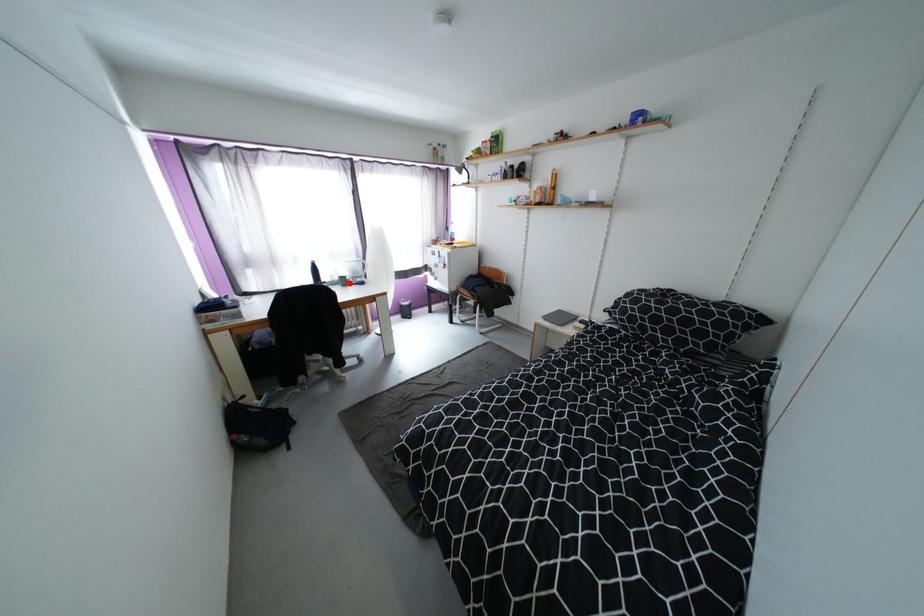
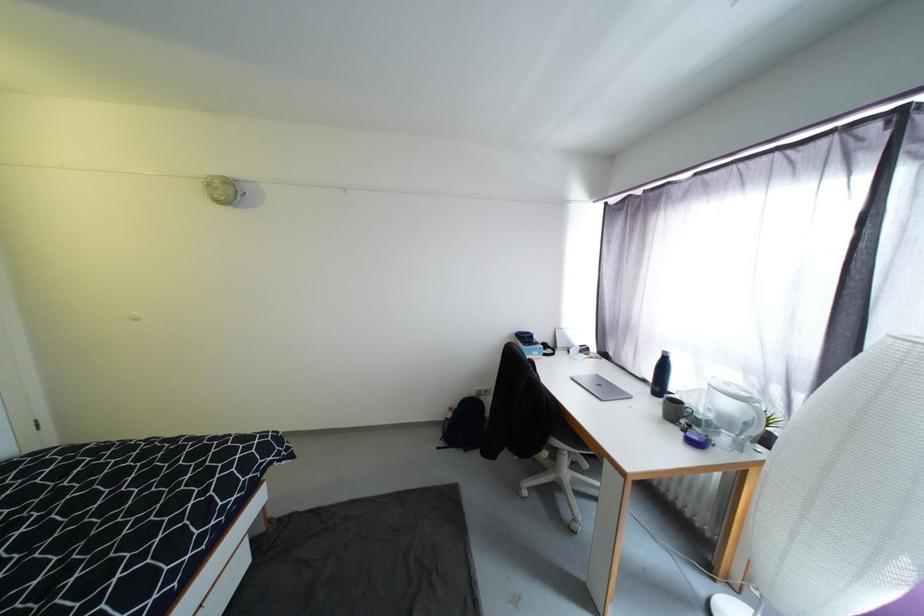
The point at the highlighted location is marked in the first image. Where is the corresponding point in the second image?

(683, 413)